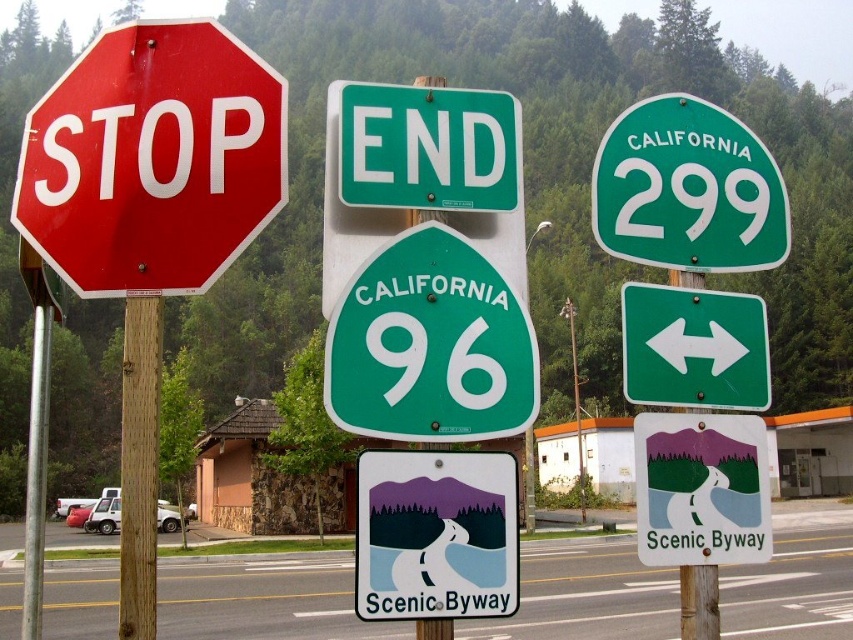
Question: Observing the image, what is the correct spatial positioning of green plastic sign at center in reference to green matte arrow at center?

Choices:
 (A) below
 (B) above

Answer: (B)

Question: From the image, what is the correct spatial relationship of white plastic sign at center in relation to green matte arrow at center?

Choices:
 (A) above
 (B) below

Answer: (B)

Question: Where is white plastic sign at center located in relation to green plastic sign at center in the image?

Choices:
 (A) below
 (B) above

Answer: (A)

Question: Among these objects, which one is nearest to the camera?

Choices:
 (A) green matte arrow at center
 (B) matte red stop sign at left
 (C) green plastic sign at center

Answer: (B)

Question: Among these objects, which one is nearest to the camera?

Choices:
 (A) brown wooden pole at left
 (B) matte red stop sign at left
 (C) green matte arrow at center
 (D) green glossy california 96 shield at center

Answer: (A)

Question: Which of the following is the farthest from the observer?

Choices:
 (A) (384, 195)
 (B) (328, 358)
 (C) (383, 460)

Answer: (A)